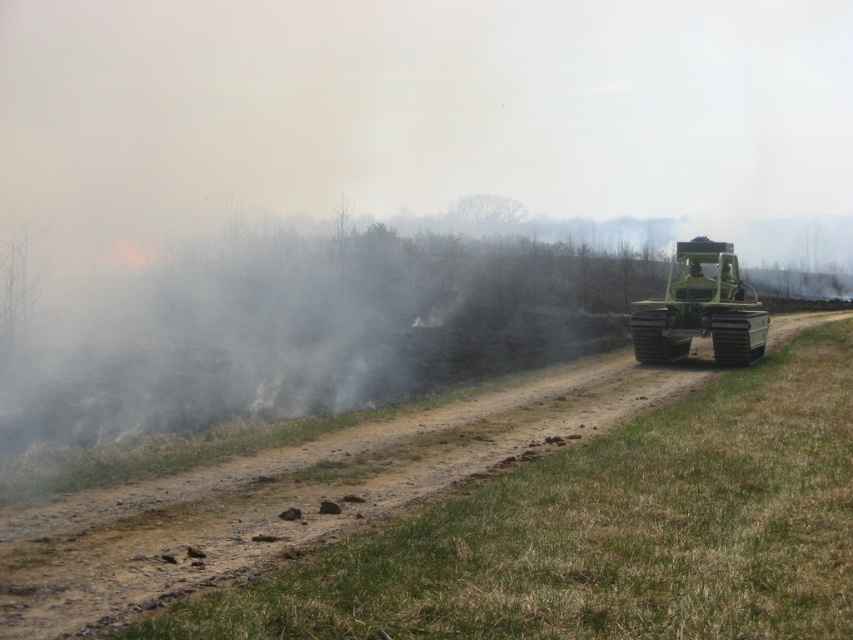
Question: Which point is closer to the camera taking this photo?

Choices:
 (A) (724, 262)
 (B) (178, 531)

Answer: (B)

Question: Is dull brown dirt at center positioned behind green rubber tractor at right?

Choices:
 (A) yes
 (B) no

Answer: (B)

Question: Is dull brown dirt at center wider than green rubber tractor at right?

Choices:
 (A) yes
 (B) no

Answer: (A)

Question: Where is dull brown dirt at center located in relation to green rubber tractor at right in the image?

Choices:
 (A) left
 (B) right

Answer: (A)

Question: Which point is closer to the camera?

Choices:
 (A) green rubber tractor at right
 (B) dull brown dirt at center

Answer: (B)

Question: Among these objects, which one is farthest from the camera?

Choices:
 (A) green rubber tractor at right
 (B) dull brown dirt at center

Answer: (A)